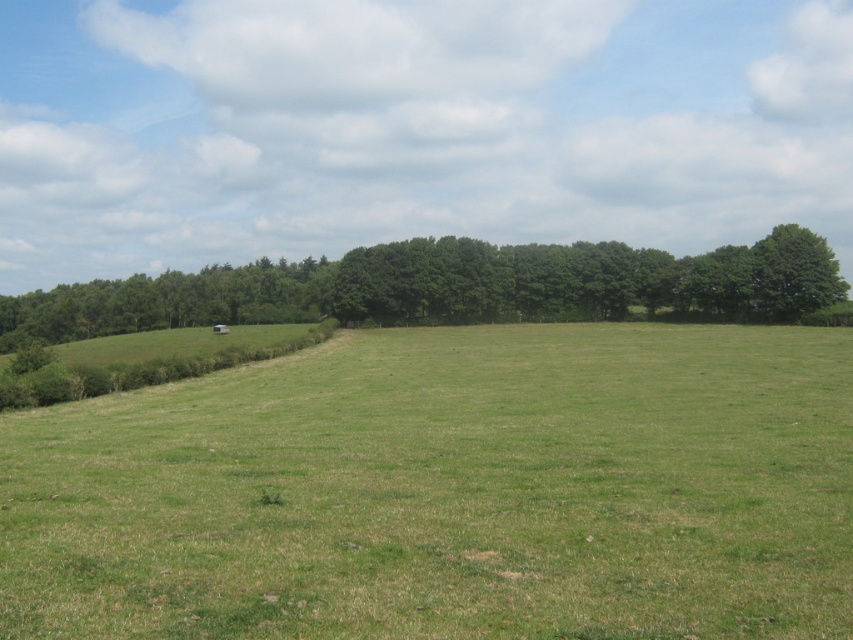
You are a landscape architect planning to plant new trees in the field. You notice the green leafy trees at center and the green leafy tree at right. Which group of trees should you prioritize for spacing adjustments to ensure proper growth, and why?

The green leafy trees at center should be prioritized for spacing adjustments because they are larger in size compared to the green leafy tree at right, requiring more space for healthy growth.

You are standing in the rural landscape and want to walk towards the green leafy trees at center. Which direction should you go to reach them first, considering their position relative to the green grass pasture at center?

Since the green grass pasture at center is closer to the viewer than the green leafy trees at center, you should walk forward towards the green leafy trees at center as they are located behind the pasture.

You are standing in the middle of the green grassy field and want to walk towards the green leafy tree at right. Which direction should you head in relation to the green leafy trees at center?

You should head to the right of the green leafy trees at center because the green leafy tree at right is positioned to the right side of the green leafy trees at center.